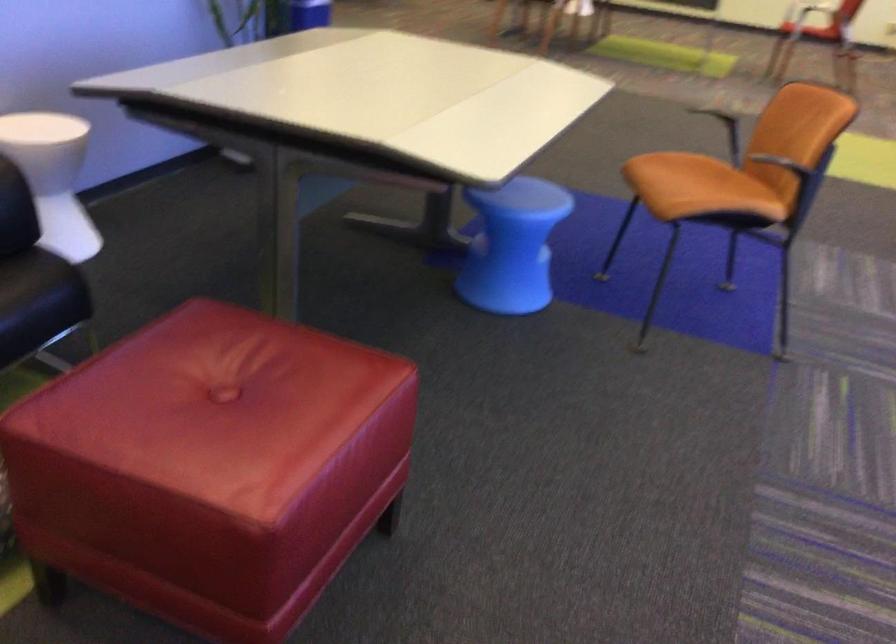
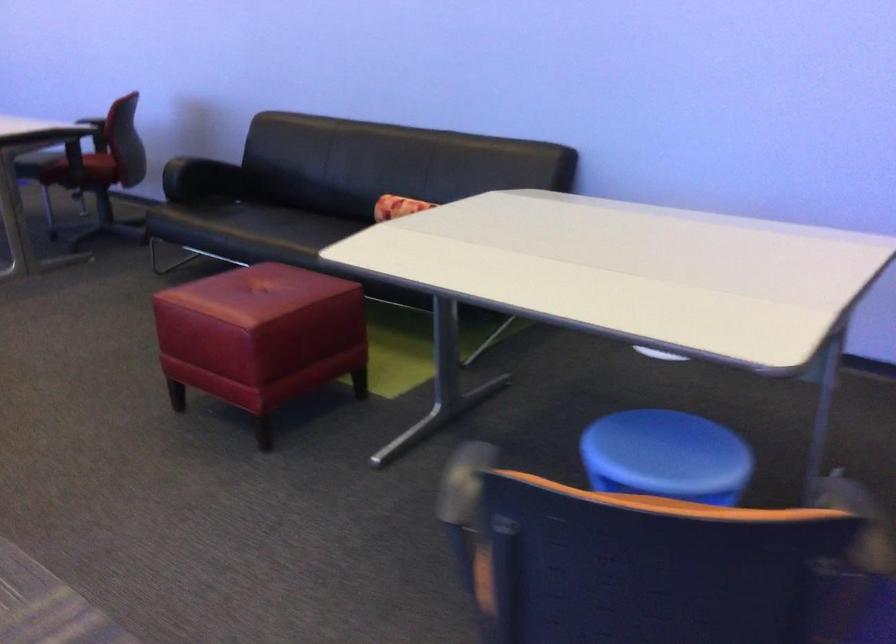
Find the pixel in the second image that matches (x=541, y=191) in the first image.

(666, 456)